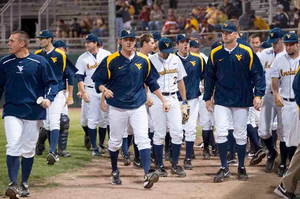
The image size is (300, 199). In order to click on cup in this screenshot , I will do `click(39, 100)`.